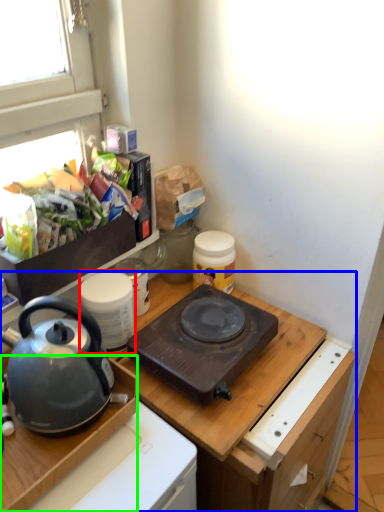
Question: Which is farther away from kitchen appliance (highlighted by a red box)? cabinetry (highlighted by a blue box) or desk (highlighted by a green box)?

Choices:
 (A) cabinetry
 (B) desk

Answer: (A)